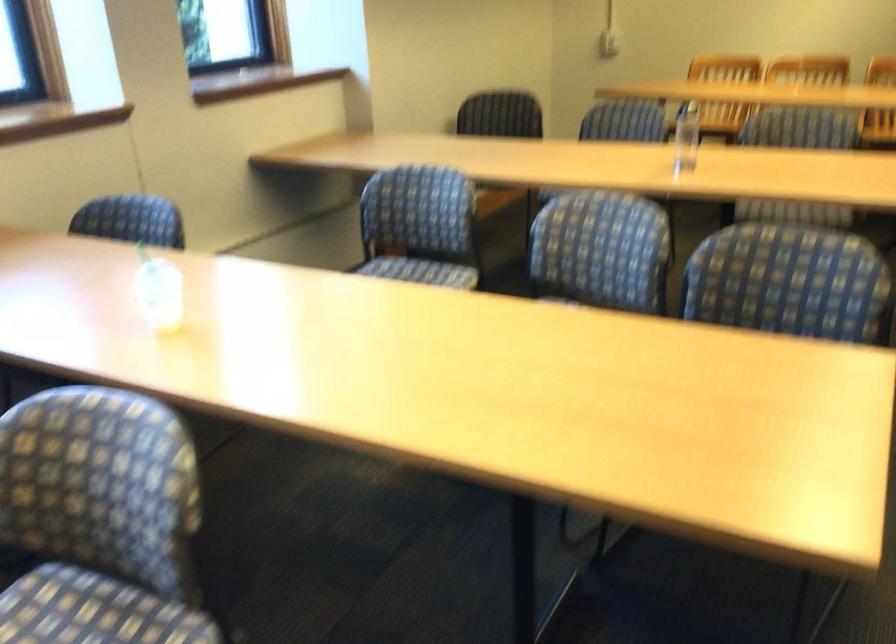
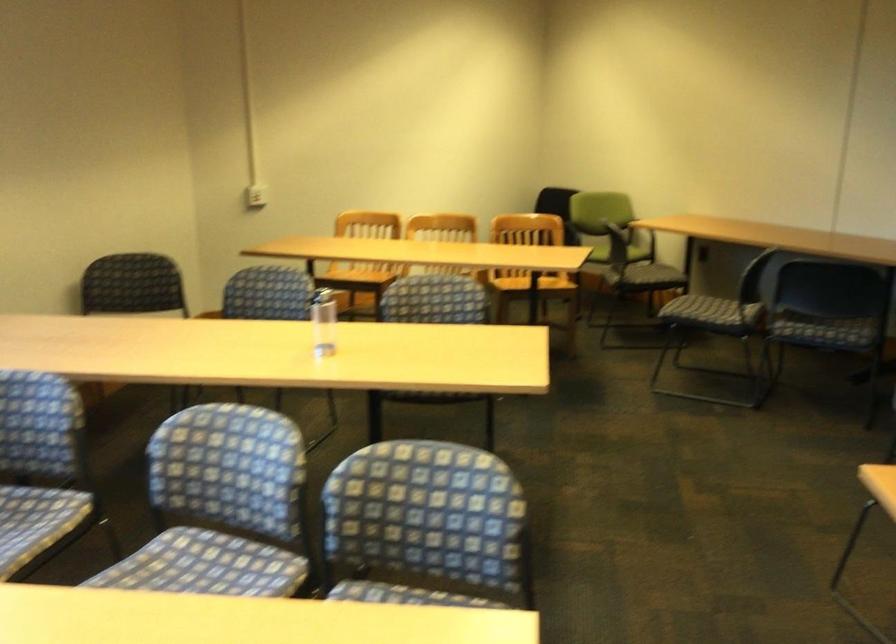
Question: Based on the continuous images, in which direction is the camera rotating? Reply with the corresponding letter.

Choices:
 (A) Left
 (B) Right
 (C) Up
 (D) Down

Answer: (B)